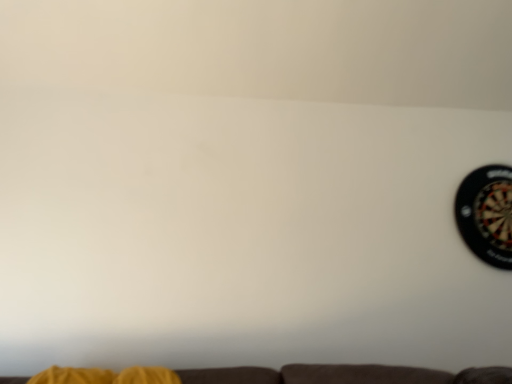
Question: Should I look upward or downward to see black plastic dartboard at right?

Choices:
 (A) up
 (B) down

Answer: (B)